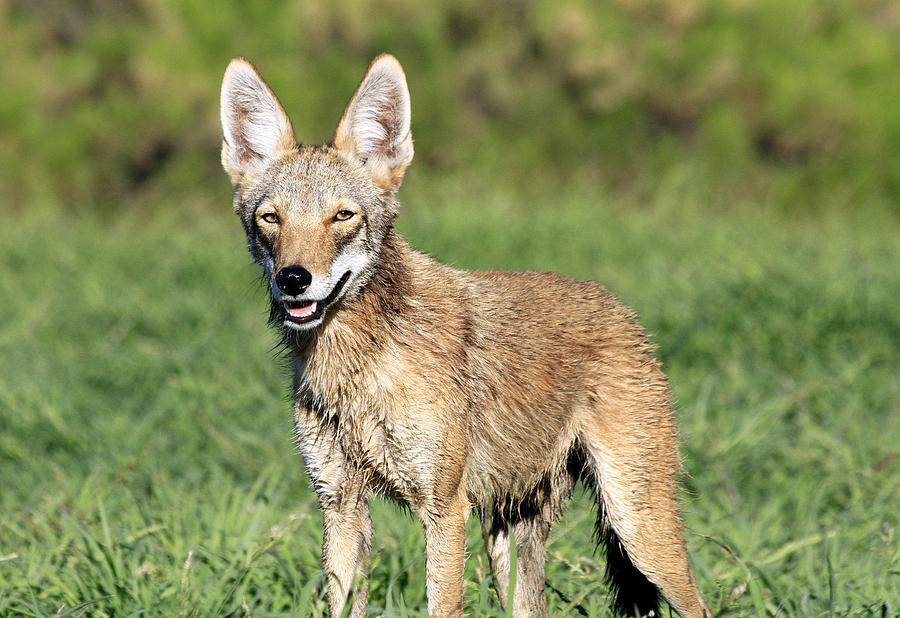
The width and height of the screenshot is (900, 618). What are the coordinates of `white fur` in the screenshot? It's located at (321, 460), (420, 442), (264, 117), (365, 122), (505, 575), (601, 481).